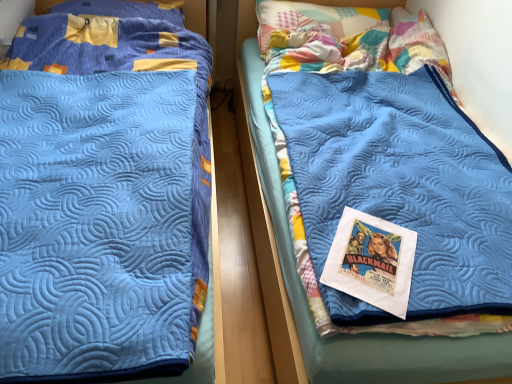
What is the approximate width of blue quilted blanket at left, marked as the 1th bed in a left-to-right arrangement?

blue quilted blanket at left, marked as the 1th bed in a left-to-right arrangement, is 2.06 meters wide.

Find the location of a particular element. The image size is (512, 384). patchwork fabric pillow at upper center, the 2th pillow when ordered from left to right is located at coordinates (314, 19).

Can you confirm if blue quilted blanket at center, the second bed positioned from the left, is positioned to the right of blue quilted blanket at left, acting as the second bed starting from the right?

Yes, blue quilted blanket at center, the second bed positioned from the left, is to the right of blue quilted blanket at left, acting as the second bed starting from the right.

Image resolution: width=512 pixels, height=384 pixels. Find the location of `bed in front of the blue quilted blanket at center, which ranks as the 1th bed in right-to-left order`. bed in front of the blue quilted blanket at center, which ranks as the 1th bed in right-to-left order is located at coordinates (102, 199).

Considering the positions of objects blue quilted blanket at center, which ranks as the 1th bed in right-to-left order, and blue quilted blanket at left, marked as the 1th bed in a left-to-right arrangement, in the image provided, who is behind, blue quilted blanket at center, which ranks as the 1th bed in right-to-left order, or blue quilted blanket at left, marked as the 1th bed in a left-to-right arrangement,?

blue quilted blanket at center, which ranks as the 1th bed in right-to-left order.

From the image's perspective, is blue quilted blanket at center, which ranks as the 1th bed in right-to-left order, located beneath blue quilted blanket at left, acting as the second bed starting from the right?

No, from the image's perspective, blue quilted blanket at center, which ranks as the 1th bed in right-to-left order, is not below blue quilted blanket at left, acting as the second bed starting from the right.

Is matte paper poster at center looking in the opposite direction of yellow fabric pillow at upper left, which ranks as the 1th pillow in left-to-right order?

No, matte paper poster at center is not facing the opposite direction of yellow fabric pillow at upper left, which ranks as the 1th pillow in left-to-right order.

Which of these two, matte paper poster at center or yellow fabric pillow at upper left, which ranks as the 1th pillow in left-to-right order, is smaller?

Smaller between the two is matte paper poster at center.

In terms of height, does matte paper poster at center look taller or shorter compared to yellow fabric pillow at upper left, which ranks as the 1th pillow in left-to-right order?

matte paper poster at center is shorter than yellow fabric pillow at upper left, which ranks as the 1th pillow in left-to-right order.

From a real-world perspective, count 2nd pillows upward from the blue quilted blanket at left, marked as the 1th bed in a left-to-right arrangement, and point to it. Please provide its 2D coordinates.

[(124, 9)]

Who is bigger, blue quilted blanket at left, marked as the 1th bed in a left-to-right arrangement, or yellow fabric pillow at upper left, which is the second pillow from right to left?

blue quilted blanket at left, marked as the 1th bed in a left-to-right arrangement.

Considering their positions, is blue quilted blanket at left, acting as the second bed starting from the right, located in front of or behind yellow fabric pillow at upper left, which is the second pillow from right to left?

blue quilted blanket at left, acting as the second bed starting from the right, is positioned closer to the viewer than yellow fabric pillow at upper left, which is the second pillow from right to left.

From a real-world perspective, which is physically above, blue quilted blanket at left, acting as the second bed starting from the right, or matte paper poster at center?

In real-world perspective, matte paper poster at center is above.

Is blue quilted blanket at left, marked as the 1th bed in a left-to-right arrangement, far from matte paper poster at center?

No, blue quilted blanket at left, marked as the 1th bed in a left-to-right arrangement, is not far from matte paper poster at center.

Between blue quilted blanket at left, acting as the second bed starting from the right, and matte paper poster at center, which one is positioned in front?

blue quilted blanket at left, acting as the second bed starting from the right, is more forward.

Is point (143, 369) closer to viewer compared to point (332, 247)?

That is True.

Choose the correct answer: Is yellow fabric pillow at upper left, which ranks as the 1th pillow in left-to-right order, inside patchwork fabric pillow at upper center, the 1th pillow positioned from the right, or outside it?

yellow fabric pillow at upper left, which ranks as the 1th pillow in left-to-right order, is spatially situated outside patchwork fabric pillow at upper center, the 1th pillow positioned from the right.

From a real-world perspective, is yellow fabric pillow at upper left, which ranks as the 1th pillow in left-to-right order, physically above patchwork fabric pillow at upper center, the 1th pillow positioned from the right?

Yes.

Does point (170, 21) come behind point (349, 16)?

No, (170, 21) is in front of (349, 16).

Is yellow fabric pillow at upper left, which is the second pillow from right to left, bigger than patchwork fabric pillow at upper center, the 1th pillow positioned from the right?

No, yellow fabric pillow at upper left, which is the second pillow from right to left, is not bigger than patchwork fabric pillow at upper center, the 1th pillow positioned from the right.

From the image's perspective, which is above, yellow fabric pillow at upper left, which is the second pillow from right to left, or matte paper poster at center?

yellow fabric pillow at upper left, which is the second pillow from right to left, is shown above in the image.

Is yellow fabric pillow at upper left, which ranks as the 1th pillow in left-to-right order, at the left side of matte paper poster at center?

Indeed, yellow fabric pillow at upper left, which ranks as the 1th pillow in left-to-right order, is positioned on the left side of matte paper poster at center.

From the picture: What's the angular difference between yellow fabric pillow at upper left, which is the second pillow from right to left, and matte paper poster at center's facing directions?

The angle between the facing direction of yellow fabric pillow at upper left, which is the second pillow from right to left, and the facing direction of matte paper poster at center is 26.7 degrees.

Consider the image. Between patchwork fabric pillow at upper center, the 2th pillow when ordered from left to right, and yellow fabric pillow at upper left, which is the second pillow from right to left, which one appears on the right side from the viewer's perspective?

From the viewer's perspective, patchwork fabric pillow at upper center, the 2th pillow when ordered from left to right, appears more on the right side.

From the image's perspective, is patchwork fabric pillow at upper center, the 1th pillow positioned from the right, positioned above or below yellow fabric pillow at upper left, which is the second pillow from right to left?

patchwork fabric pillow at upper center, the 1th pillow positioned from the right, is below yellow fabric pillow at upper left, which is the second pillow from right to left.

Is patchwork fabric pillow at upper center, the 2th pillow when ordered from left to right, oriented away from yellow fabric pillow at upper left, which ranks as the 1th pillow in left-to-right order?

That's not correct — patchwork fabric pillow at upper center, the 2th pillow when ordered from left to right, is not looking away from yellow fabric pillow at upper left, which ranks as the 1th pillow in left-to-right order.

Is patchwork fabric pillow at upper center, the 2th pillow when ordered from left to right, smaller than yellow fabric pillow at upper left, which is the second pillow from right to left?

Actually, patchwork fabric pillow at upper center, the 2th pillow when ordered from left to right, might be larger than yellow fabric pillow at upper left, which is the second pillow from right to left.

Identify the location of bed located above the blue quilted blanket at center, which ranks as the 1th bed in right-to-left order (from a real-world perspective). (102, 199).

At what (x,y) coordinates should I click in order to perform the action: click on comic book below the yellow fabric pillow at upper left, which is the second pillow from right to left (from the image's perspective). Please return your answer as a coordinate pair (x, y). The height and width of the screenshot is (384, 512). Looking at the image, I should click on (372, 261).

Which object lies further to the anchor point yellow fabric pillow at upper left, which is the second pillow from right to left, patchwork fabric pillow at upper center, the 1th pillow positioned from the right, or matte paper poster at center?

Based on the image, matte paper poster at center appears to be further to yellow fabric pillow at upper left, which is the second pillow from right to left.

Estimate the real-world distances between objects in this image. Which object is closer to patchwork fabric pillow at upper center, the 2th pillow when ordered from left to right, blue quilted blanket at left, marked as the 1th bed in a left-to-right arrangement, or blue quilted blanket at center, the second bed positioned from the left?

The object closer to patchwork fabric pillow at upper center, the 2th pillow when ordered from left to right, is blue quilted blanket at center, the second bed positioned from the left.

From the image, which object appears to be farther from blue quilted blanket at left, marked as the 1th bed in a left-to-right arrangement, yellow fabric pillow at upper left, which is the second pillow from right to left, or blue quilted blanket at center, which ranks as the 1th bed in right-to-left order?

Among the two, yellow fabric pillow at upper left, which is the second pillow from right to left, is located further to blue quilted blanket at left, marked as the 1th bed in a left-to-right arrangement.

Looking at the image, which one is located closer to yellow fabric pillow at upper left, which ranks as the 1th pillow in left-to-right order, blue quilted blanket at left, acting as the second bed starting from the right, or patchwork fabric pillow at upper center, the 2th pillow when ordered from left to right?

blue quilted blanket at left, acting as the second bed starting from the right, is positioned closer to the anchor yellow fabric pillow at upper left, which ranks as the 1th pillow in left-to-right order.

From the image, which object appears to be farther from matte paper poster at center, blue quilted blanket at center, which ranks as the 1th bed in right-to-left order, or patchwork fabric pillow at upper center, the 2th pillow when ordered from left to right?

patchwork fabric pillow at upper center, the 2th pillow when ordered from left to right, is further to matte paper poster at center.

Looking at the image, which one is located closer to matte paper poster at center, yellow fabric pillow at upper left, which is the second pillow from right to left, or blue quilted blanket at center, which ranks as the 1th bed in right-to-left order?

Among the two, blue quilted blanket at center, which ranks as the 1th bed in right-to-left order, is located nearer to matte paper poster at center.

Looking at the image, which one is located closer to blue quilted blanket at center, the second bed positioned from the left, matte paper poster at center or blue quilted blanket at left, marked as the 1th bed in a left-to-right arrangement?

matte paper poster at center.

When comparing their distances from blue quilted blanket at left, marked as the 1th bed in a left-to-right arrangement, does blue quilted blanket at center, which ranks as the 1th bed in right-to-left order, or patchwork fabric pillow at upper center, the 1th pillow positioned from the right, seem closer?

Among the two, blue quilted blanket at center, which ranks as the 1th bed in right-to-left order, is located nearer to blue quilted blanket at left, marked as the 1th bed in a left-to-right arrangement.

At what (x,y) coordinates should I click in order to perform the action: click on comic book positioned between blue quilted blanket at center, which ranks as the 1th bed in right-to-left order, and yellow fabric pillow at upper left, which is the second pillow from right to left, from near to far. Please return your answer as a coordinate pair (x, y). Looking at the image, I should click on (372, 261).

This screenshot has height=384, width=512. What are the coordinates of `bed between blue quilted blanket at left, marked as the 1th bed in a left-to-right arrangement, and yellow fabric pillow at upper left, which is the second pillow from right to left, from front to back` in the screenshot? It's located at (306, 298).

At what (x,y) coordinates should I click in order to perform the action: click on comic book between yellow fabric pillow at upper left, which is the second pillow from right to left, and patchwork fabric pillow at upper center, the 1th pillow positioned from the right, in the horizontal direction. Please return your answer as a coordinate pair (x, y). Looking at the image, I should click on (372, 261).

Find the location of a particular element. This screenshot has height=384, width=512. comic book between blue quilted blanket at center, the second bed positioned from the left, and patchwork fabric pillow at upper center, the 2th pillow when ordered from left to right, in the front-back direction is located at coordinates (372, 261).